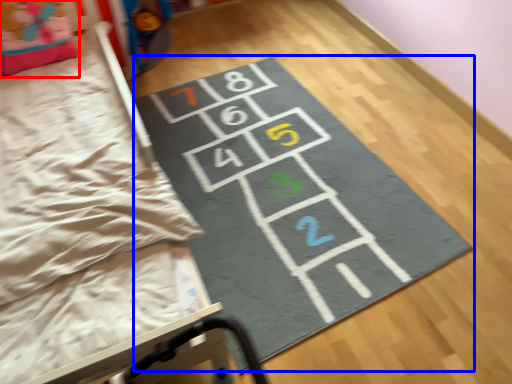
Question: Which point is closer to the camera, pillow (highlighted by a red box) or yoga mat (highlighted by a blue box)?

Choices:
 (A) pillow
 (B) yoga mat

Answer: (B)